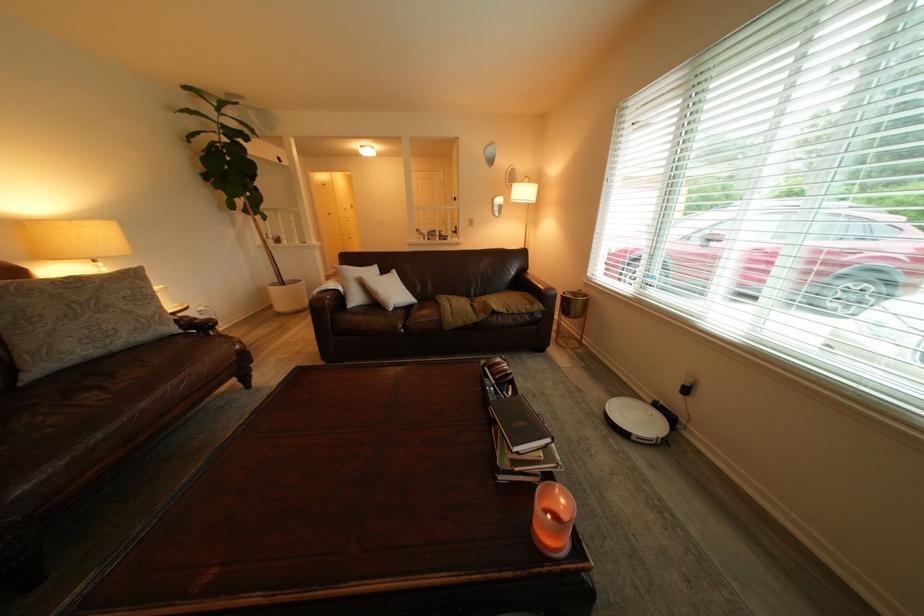
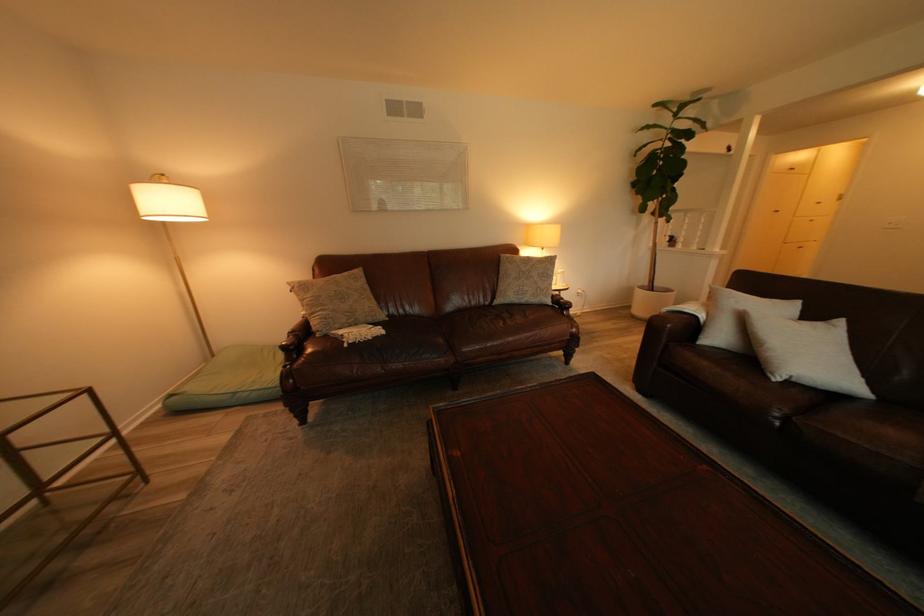
Where in the second image is the point corresponding to point 405,312 from the first image?

(787, 381)